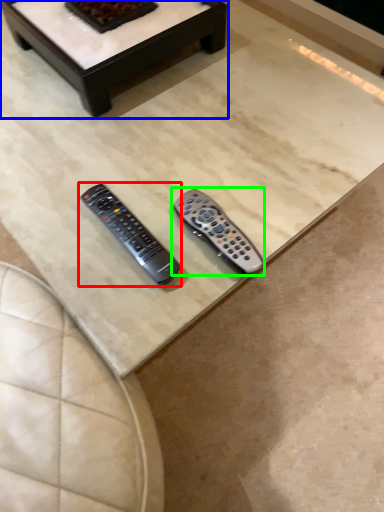
Question: Which is farther away from remote control (highlighted by a red box)? coffee table (highlighted by a blue box) or remote control (highlighted by a green box)?

Choices:
 (A) coffee table
 (B) remote control

Answer: (A)